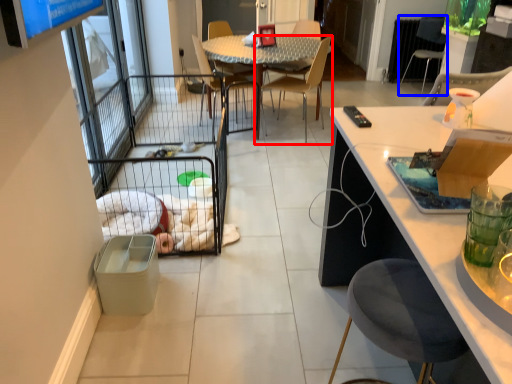
Question: Which object is closer to the camera taking this photo, chair (highlighted by a red box) or chair (highlighted by a blue box)?

Choices:
 (A) chair
 (B) chair

Answer: (A)